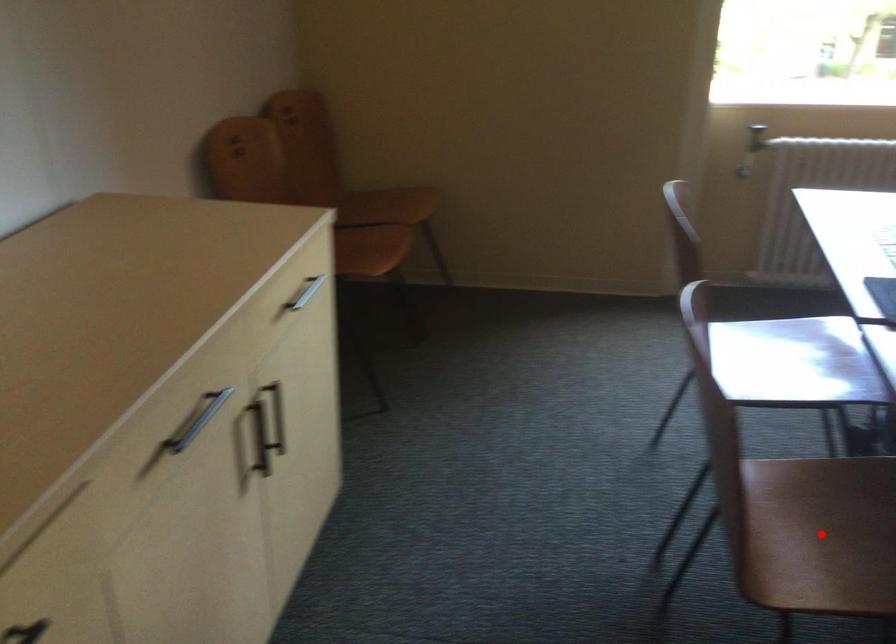
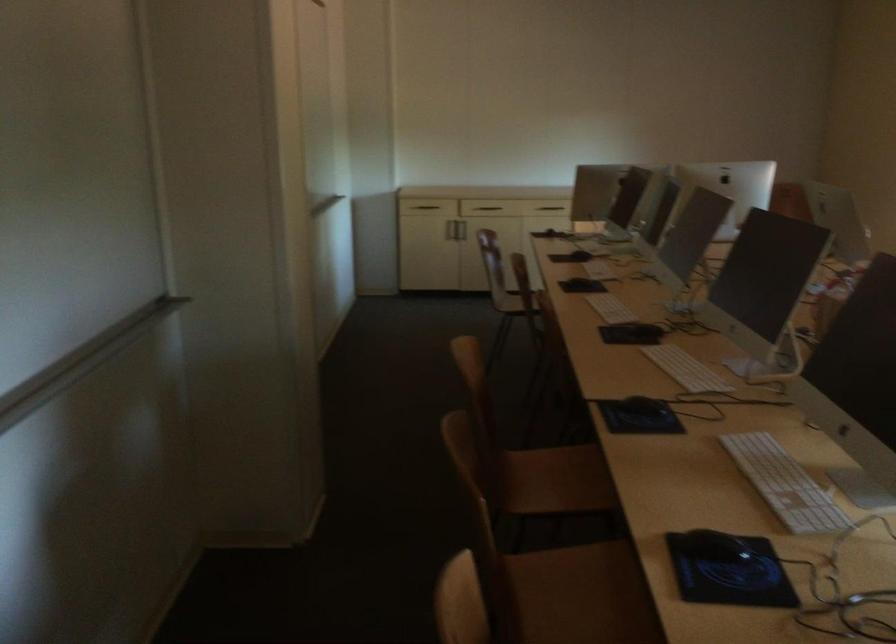
Question: I am providing you with two images of the same scene from different viewpoints. A red point is marked on the first image. Can you still see the location of the red point in image 2?

Choices:
 (A) Yes
 (B) No

Answer: (B)